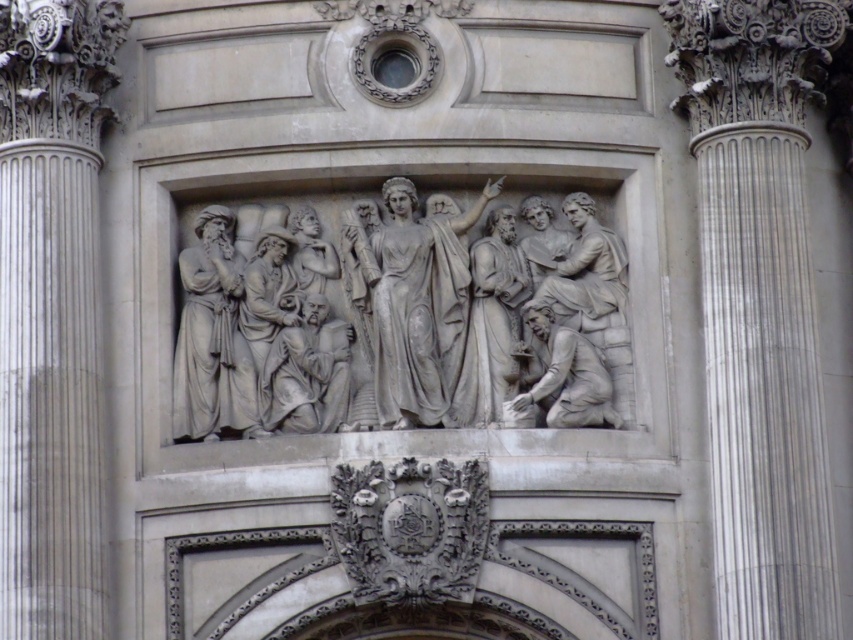
In the scene shown: Does gray stone relief at center have a greater height compared to gray stone statue at center?

Yes, gray stone relief at center is taller than gray stone statue at center.

Where is `gray stone relief at center`? gray stone relief at center is located at coordinates (399, 314).

Where is `gray stone relief at center`? gray stone relief at center is located at coordinates (399, 314).

Is gray stone relief at center above white marble column at right?

Actually, gray stone relief at center is below white marble column at right.

What do you see at coordinates (399, 314) in the screenshot? This screenshot has width=853, height=640. I see `gray stone relief at center` at bounding box center [399, 314].

Identify the location of gray stone relief at center. This screenshot has height=640, width=853. (399, 314).

Is point (334, 321) in front of point (180, 356)?

No, (334, 321) is further to viewer.

Can you confirm if gray stone relief at center is wider than gray stone figure at left?

Correct, the width of gray stone relief at center exceeds that of gray stone figure at left.

The image size is (853, 640). What do you see at coordinates (399, 314) in the screenshot? I see `gray stone relief at center` at bounding box center [399, 314].

You are a GUI agent. You are given a task and a screenshot of the screen. Output one action in this format:
    pyautogui.click(x=<x>, y=<y>)
    Task: Click on the gray stone relief at center
    The image size is (853, 640).
    Given the screenshot: What is the action you would take?
    pyautogui.click(x=399, y=314)